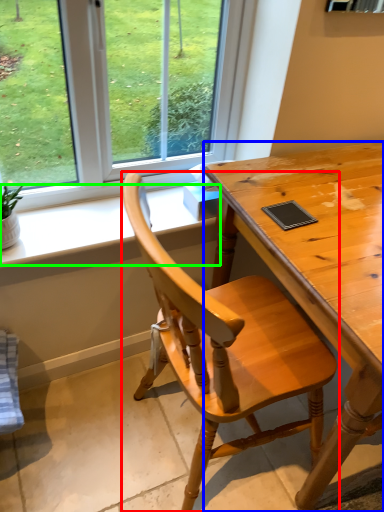
Question: Estimate the real-world distances between objects in this image. Which object is closer to chair (highlighted by a red box), desk (highlighted by a blue box) or window sill (highlighted by a green box)?

Choices:
 (A) desk
 (B) window sill

Answer: (A)